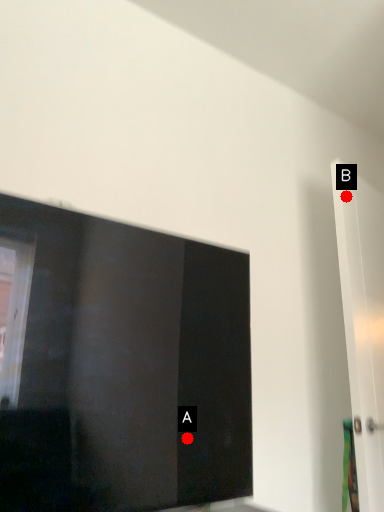
Question: Two points are circled on the image, labeled by A and B beside each circle. Which point is closer to the camera taking this photo?

Choices:
 (A) A is closer
 (B) B is closer

Answer: (A)